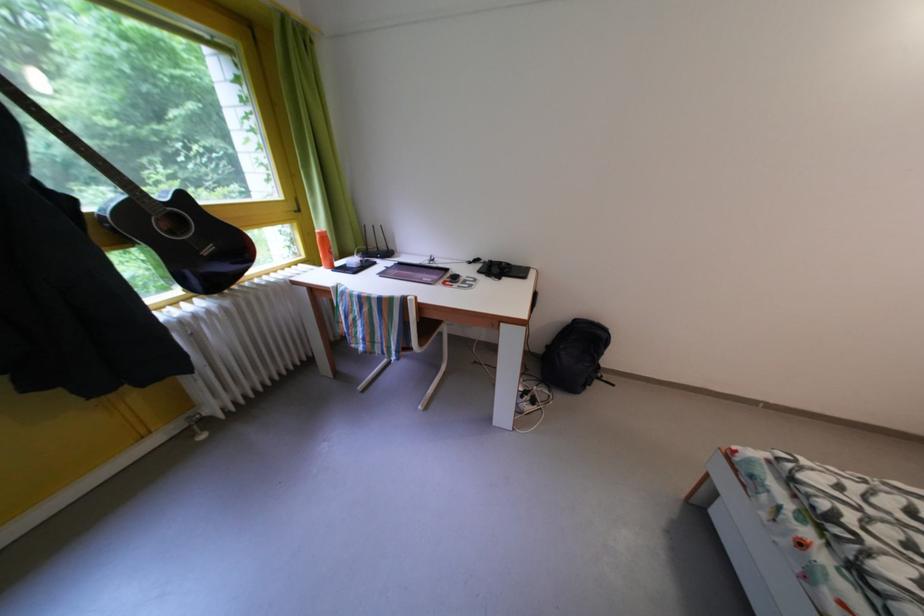
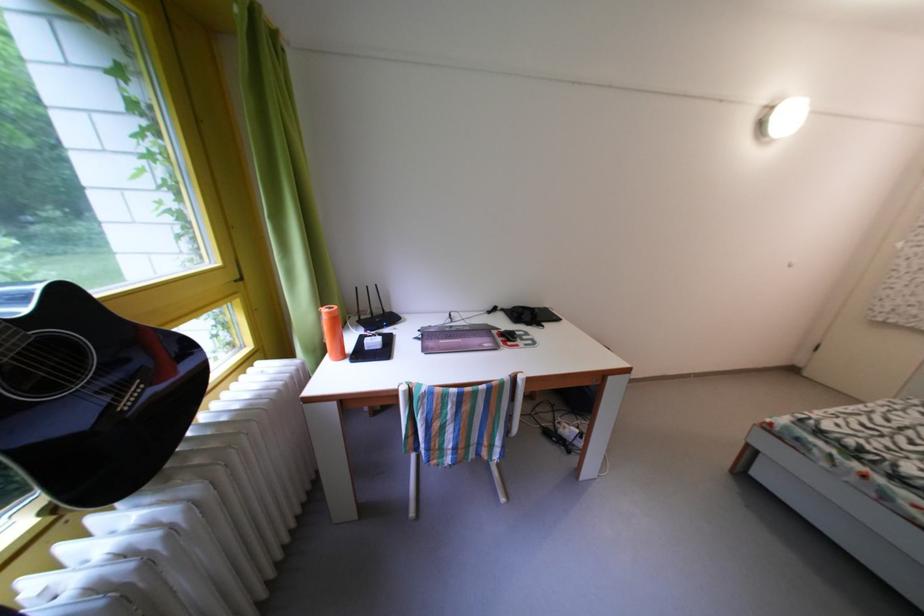
Question: The camera is either moving clockwise (left) or counter-clockwise (right) around the object. The first image is from the beginning of the video and the second image is from the end. Is the camera moving left or right when shooting the video?

Choices:
 (A) Left
 (B) Right

Answer: (A)